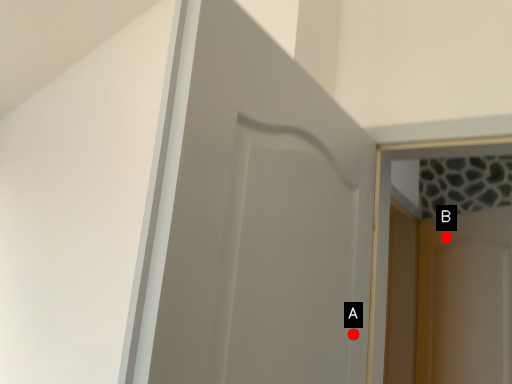
Question: Two points are circled on the image, labeled by A and B beside each circle. Which point is closer to the camera?

Choices:
 (A) A is closer
 (B) B is closer

Answer: (A)